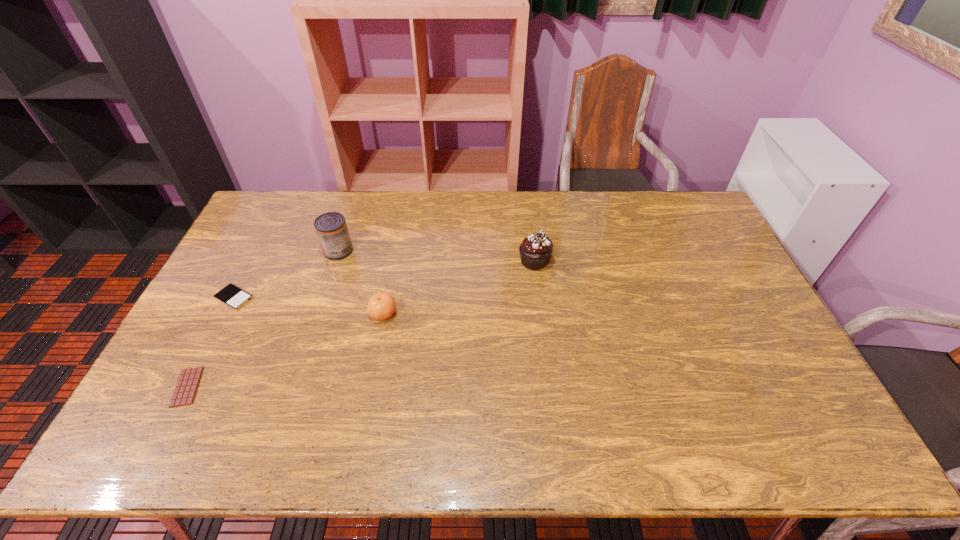
Locate an element on the screen. free space between the second object from right to left and the candy bar is located at coordinates (285, 350).

You are a GUI agent. You are given a task and a screenshot of the screen. Output one action in this format:
    pyautogui.click(x=<x>, y=<y>)
    Task: Click on the closest object to the rightmost object
    This screenshot has width=960, height=540.
    Given the screenshot: What is the action you would take?
    pyautogui.click(x=381, y=306)

Select which object appears as the second closest to the can. Please provide its 2D coordinates. Your answer should be formatted as a tuple, i.e. [(x, y)], where the tuple contains the x and y coordinates of a point satisfying the conditions above.

[(381, 306)]

The image size is (960, 540). I want to click on free location that satisfies the following two spatial constraints: 1. on the back side of the fourth object from left to right; 2. on the left side of the cupcake, so click(394, 261).

This screenshot has width=960, height=540. I want to click on free location that satisfies the following two spatial constraints: 1. on the back side of the cupcake; 2. on the right side of the fourth tallest object, so click(x=252, y=261).